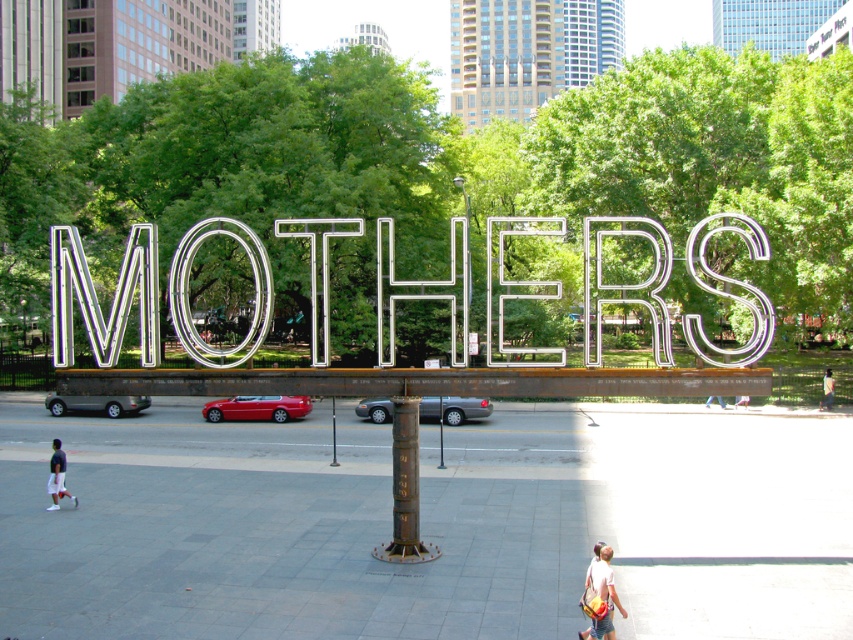
You are standing at the point marked by the coordinate point [427,524] in the image. Looking around, you see the large illuminated sign reading

The gray concrete pavement at center is represented by point [427,524], so you are standing on the gray concrete pavement at center.

You are a delivery person who needs to place a light brown leather jacket at lower right on the gray concrete pavement at center. Can the jacket fit on the pavement if the jacket is 2 feet wide?

The gray concrete pavement at center is wider than the light brown leather jacket at lower right, so the jacket can fit on the pavement.